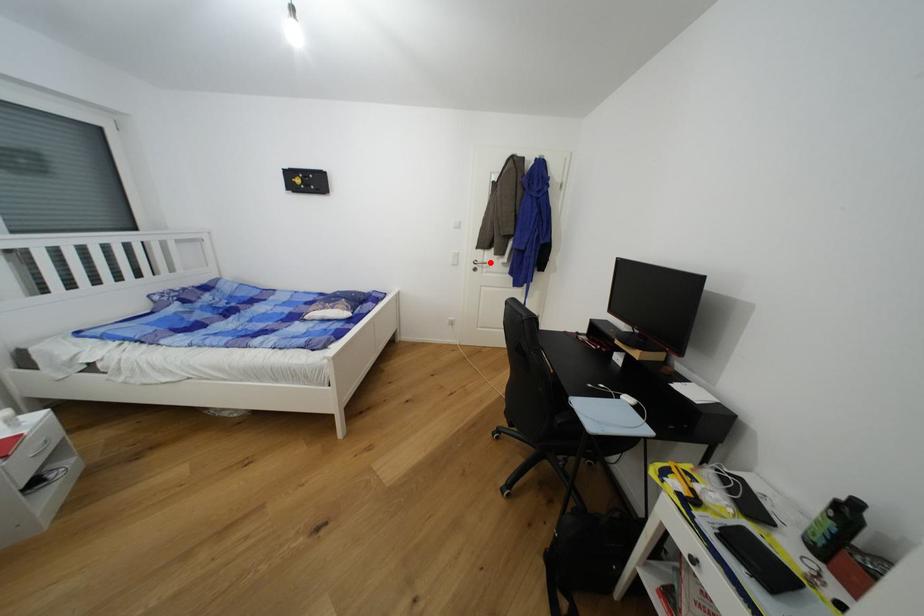
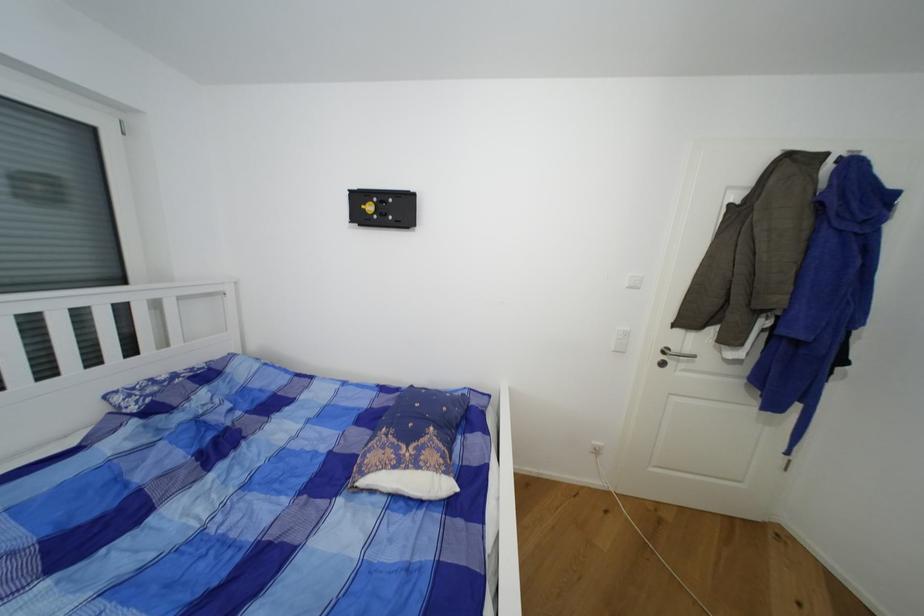
In the second image, find the point that corresponds to the highlighted location in the first image.

(691, 352)